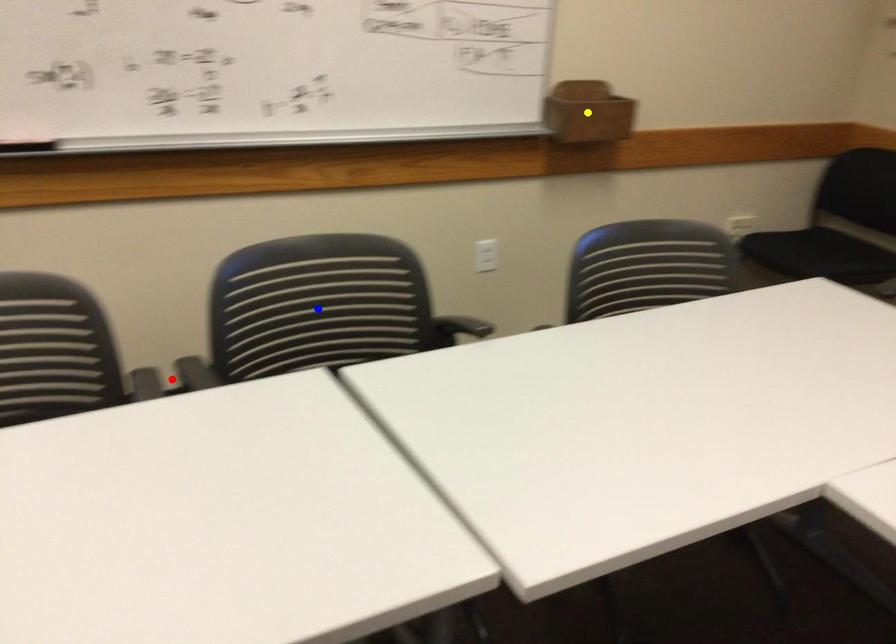
Order these from farthest to nearest:
blue point, yellow point, red point

yellow point
blue point
red point